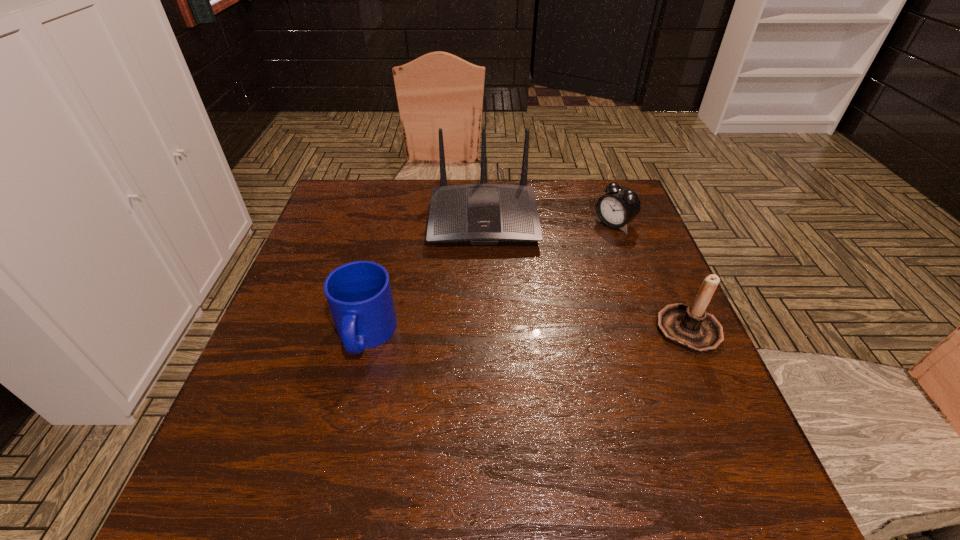
The width and height of the screenshot is (960, 540). In order to click on vacant point located on the front side of the alarm clock in this screenshot , I will do `click(522, 299)`.

At what (x,y) coordinates should I click in order to perform the action: click on free space located 0.280m on the front side of the alarm clock. Please return your answer as a coordinate pair (x, y). Image resolution: width=960 pixels, height=540 pixels. Looking at the image, I should click on click(541, 284).

This screenshot has height=540, width=960. I want to click on free point located on the front side of the alarm clock, so click(587, 246).

The width and height of the screenshot is (960, 540). Find the location of `router located in the far edge section of the desktop`. router located in the far edge section of the desktop is located at coordinates (480, 214).

I want to click on alarm clock situated at the far edge, so click(620, 205).

Identify the location of object that is at the left edge. Image resolution: width=960 pixels, height=540 pixels. (359, 295).

Locate an element on the screen. candle holder at the right edge is located at coordinates (690, 327).

At what (x,y) coordinates should I click in order to perform the action: click on alarm clock that is at the right edge. Please return your answer as a coordinate pair (x, y). The image size is (960, 540). Looking at the image, I should click on (620, 205).

Image resolution: width=960 pixels, height=540 pixels. I want to click on object situated at the far right corner, so click(x=620, y=205).

In the image, there is a desktop. Identify the location of blank space at the far edge. (386, 213).